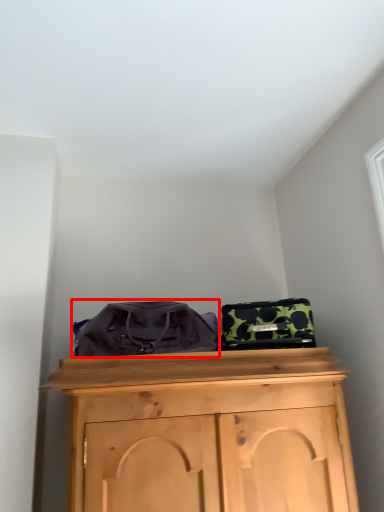
Question: Where is messenger bag (annotated by the red box) located in relation to luggage in the image?

Choices:
 (A) right
 (B) left

Answer: (B)